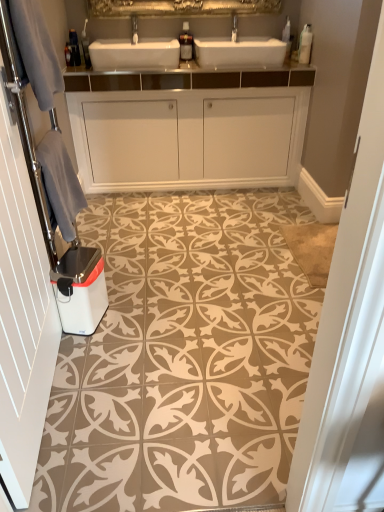
Identify the location of free space that is in between white textured towel at left and white glossy dishwasher at lower left. The height and width of the screenshot is (512, 384). (70, 382).